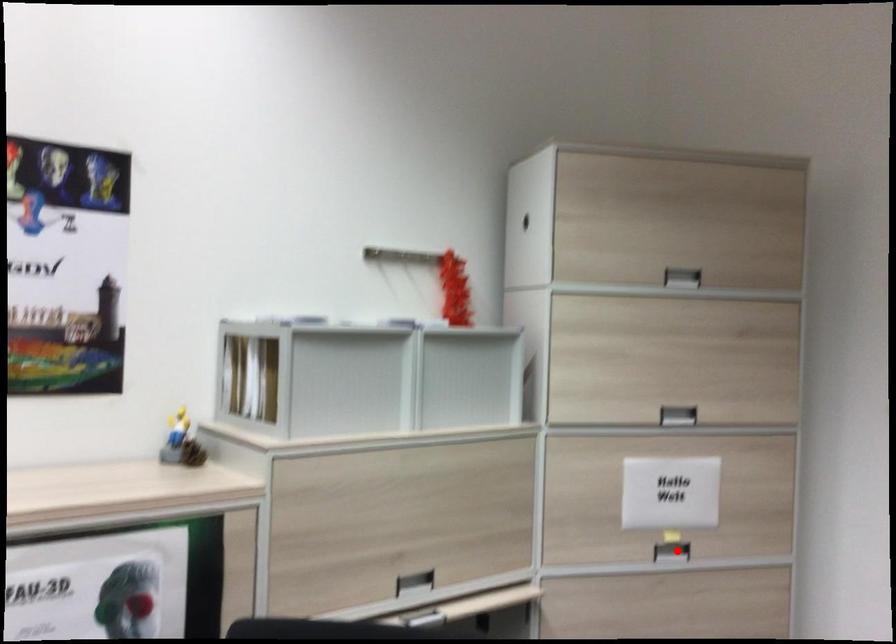
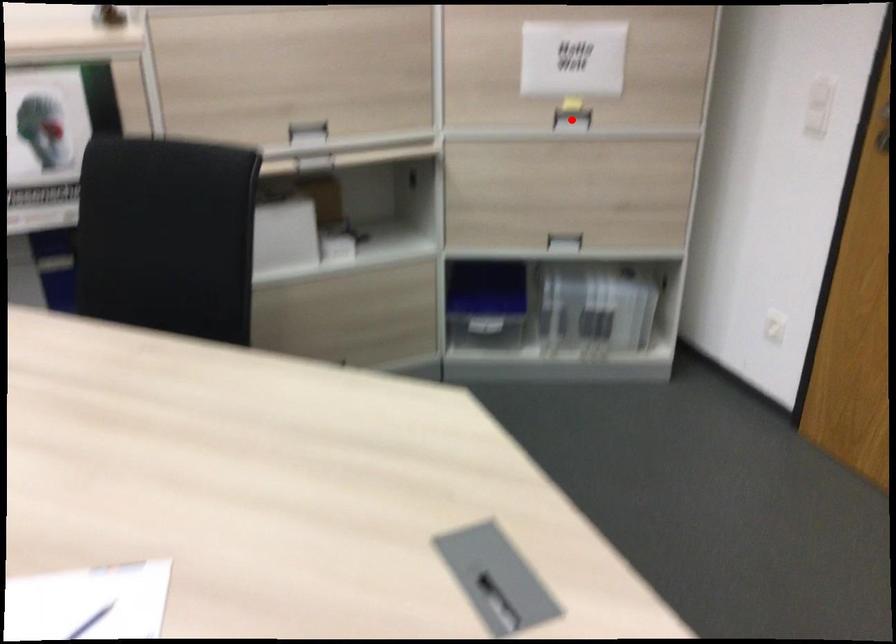
I am providing you with two images of the same scene from different viewpoints. A red point is marked on the first image and another point is marked on the second image. Is the marked point in image1 the same physical position as the marked point in image2?

Yes